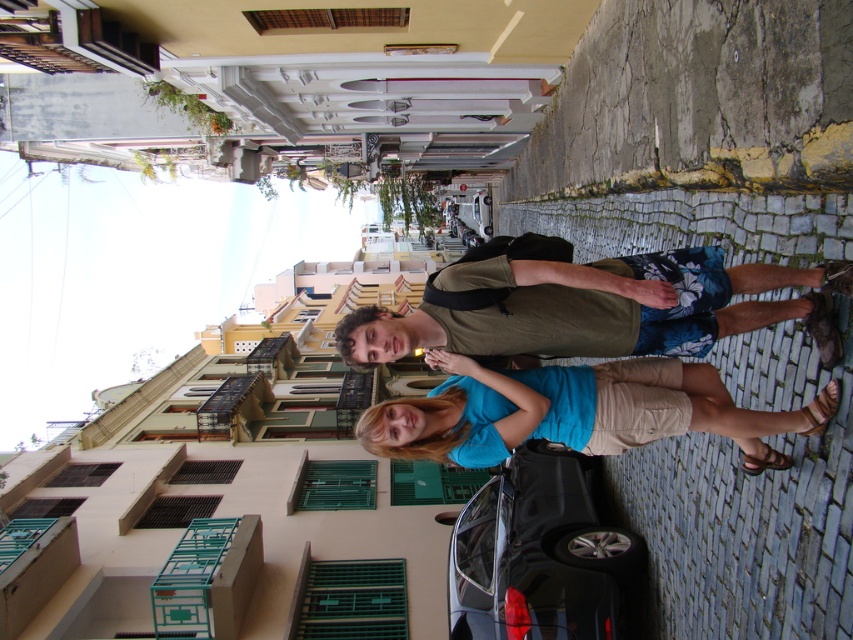
Does blue cotton shirt at center have a larger size compared to shiny black car at center?

Yes.

Who is more forward, (602, 429) or (483, 634)?

Point (602, 429)

Where is `blue cotton shirt at center`? The height and width of the screenshot is (640, 853). blue cotton shirt at center is located at coordinates (577, 412).

Does green cotton shirt at center appear over blue cotton shirt at center?

Indeed, green cotton shirt at center is positioned over blue cotton shirt at center.

The width and height of the screenshot is (853, 640). What do you see at coordinates (590, 305) in the screenshot?
I see `green cotton shirt at center` at bounding box center [590, 305].

At what (x,y) coordinates should I click in order to perform the action: click on green cotton shirt at center. Please return your answer as a coordinate pair (x, y). The width and height of the screenshot is (853, 640). Looking at the image, I should click on (590, 305).

Does green cotton shirt at center have a larger size compared to shiny black car at center?

No, green cotton shirt at center is not bigger than shiny black car at center.

Consider the image. Can you confirm if green cotton shirt at center is smaller than shiny black car at center?

Correct, green cotton shirt at center occupies less space than shiny black car at center.

At what (x,y) coordinates should I click in order to perform the action: click on green cotton shirt at center. Please return your answer as a coordinate pair (x, y). This screenshot has width=853, height=640. Looking at the image, I should click on (590, 305).

This screenshot has width=853, height=640. I want to click on green cotton shirt at center, so click(590, 305).